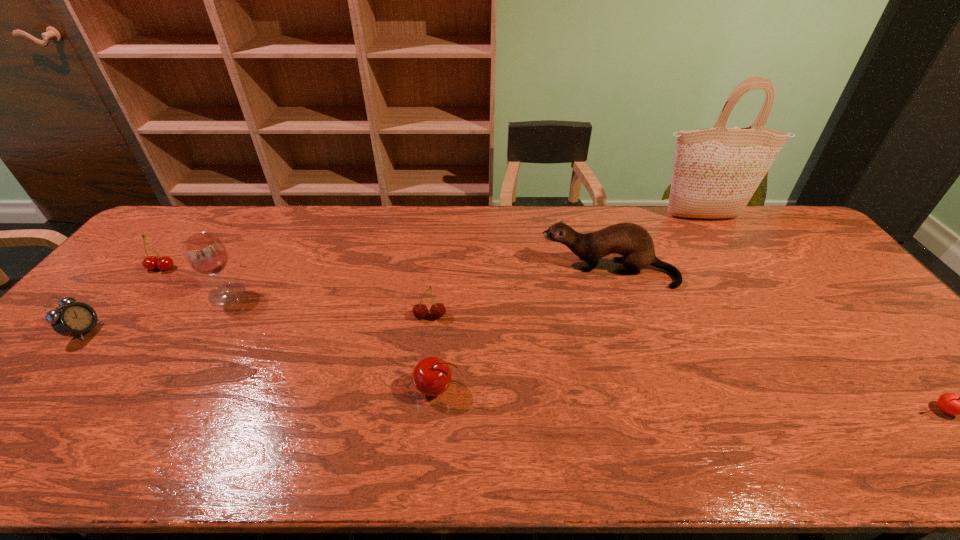
You are a GUI agent. You are given a task and a screenshot of the screen. Output one action in this format:
    pyautogui.click(x=<x>, y=<y>)
    Task: Click on the object positioned at the right edge
    The width and height of the screenshot is (960, 540).
    Given the screenshot: What is the action you would take?
    click(716, 171)

Where is `object positioned at the far right corner`? object positioned at the far right corner is located at coordinates (716, 171).

I want to click on vacant region at the far edge, so click(x=542, y=218).

Locate an element on the screen. The height and width of the screenshot is (540, 960). vacant space at the near edge of the desktop is located at coordinates (416, 452).

In the image, there is a desktop. At what (x,y) coordinates should I click in order to perform the action: click on vacant space at the left edge. Please return your answer as a coordinate pair (x, y). Image resolution: width=960 pixels, height=540 pixels. Looking at the image, I should click on pyautogui.click(x=147, y=293).

You are a GUI agent. You are given a task and a screenshot of the screen. Output one action in this format:
    pyautogui.click(x=<x>, y=<y>)
    Task: Click on the free region at the right edge
    The height and width of the screenshot is (540, 960).
    Given the screenshot: What is the action you would take?
    pyautogui.click(x=844, y=299)

You are a GUI agent. You are given a task and a screenshot of the screen. Output one action in this format:
    pyautogui.click(x=<x>, y=<y>)
    Task: Click on the free space between the leftmost cherry and the ferret
    This screenshot has height=540, width=960.
    Given the screenshot: What is the action you would take?
    pyautogui.click(x=385, y=269)

Identify the location of free space between the shopping bag and the second farthest cherry. The height and width of the screenshot is (540, 960). (565, 267).

You are a GUI agent. You are given a task and a screenshot of the screen. Output one action in this format:
    pyautogui.click(x=<x>, y=<y>)
    Task: Click on the free area in between the sixth object from left to right and the leftmost cherry
    
    Given the screenshot: What is the action you would take?
    [385, 269]

The width and height of the screenshot is (960, 540). Find the location of `free space between the third nearest cherry and the sixth shortest object`. free space between the third nearest cherry and the sixth shortest object is located at coordinates (519, 294).